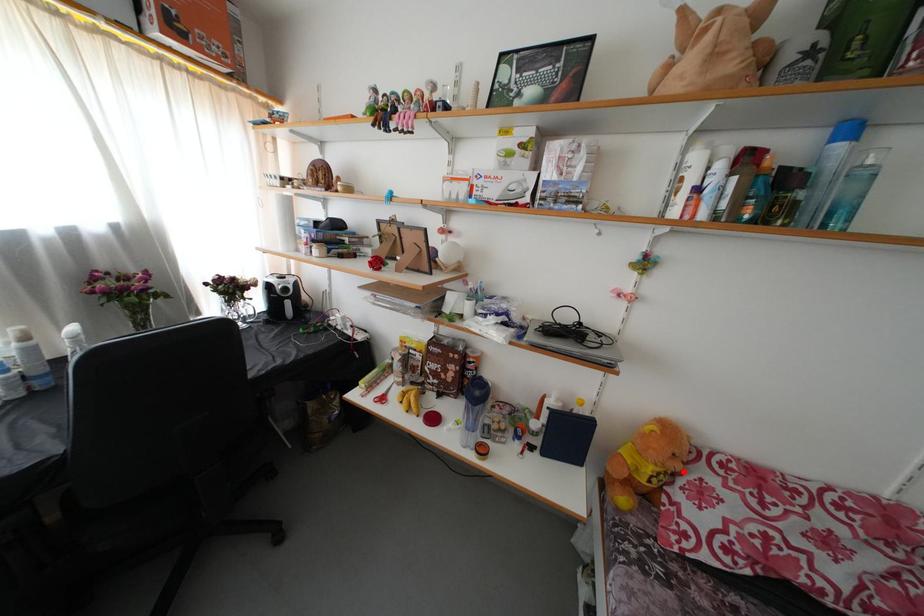
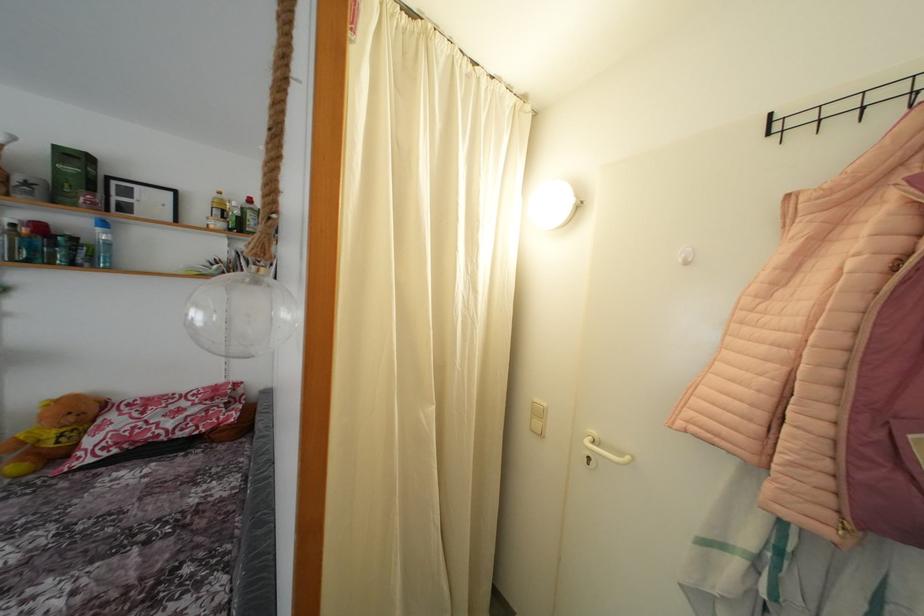
Question: I am providing you with two images of the same scene from different viewpoints. In image1, a red point is highlighted. Considering the same 3D point in image2, which of the following is correct?

Choices:
 (A) It is closer
 (B) It is farther

Answer: (A)